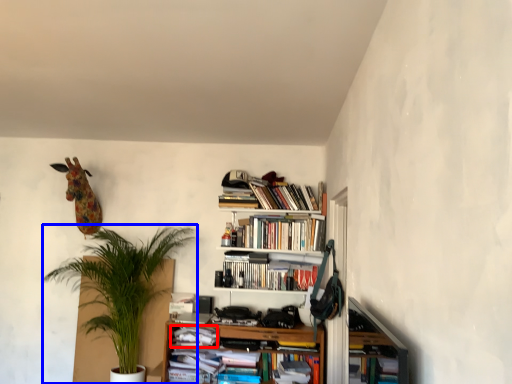
Question: Which of the following is the closest to the observer, book (highlighted by a red box) or houseplant (highlighted by a blue box)?

Choices:
 (A) book
 (B) houseplant

Answer: (B)